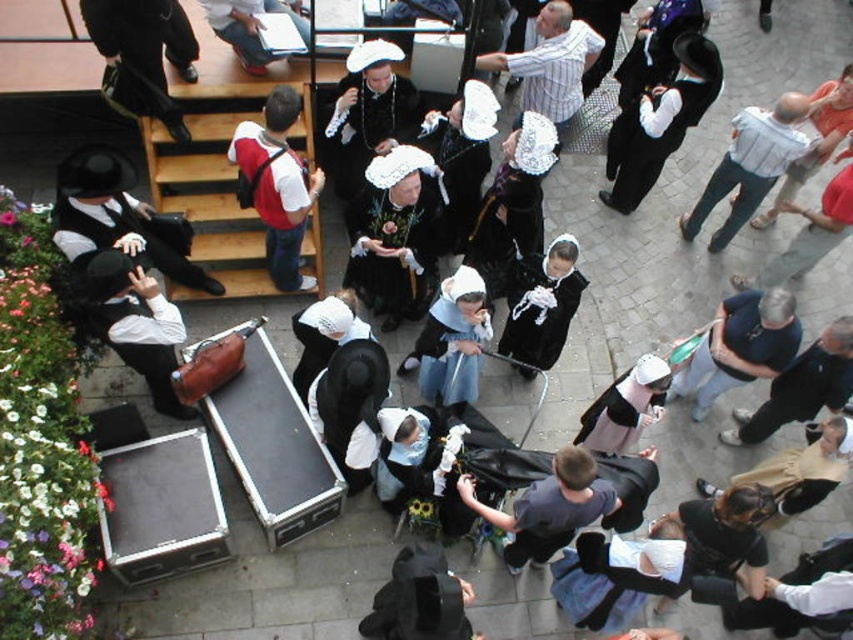
You are a photographer trying to capture the entire scene. You notice the matte black hat at left and the white cotton shirt at upper right. Which object should you position closer to the left side of your camera frame to include both in the shot?

To include both the matte black hat at left and the white cotton shirt at upper right in your shot, position the matte black hat at left closer to the left side of your camera frame since it is already located to the left of the white cotton shirt at upper right.

You are organizing a photo shoot and need to place a matte black hat at left and a striped cotton shirt at center in a way that they are both visible in the frame. Given their sizes, which item should be placed closer to the camera to ensure both fit within the frame?

The matte black hat at left has a smaller width than the striped cotton shirt at center. To ensure both fit within the frame, the matte black hat at left should be placed closer to the camera so that its smaller size can be balanced with the larger striped cotton shirt at center.